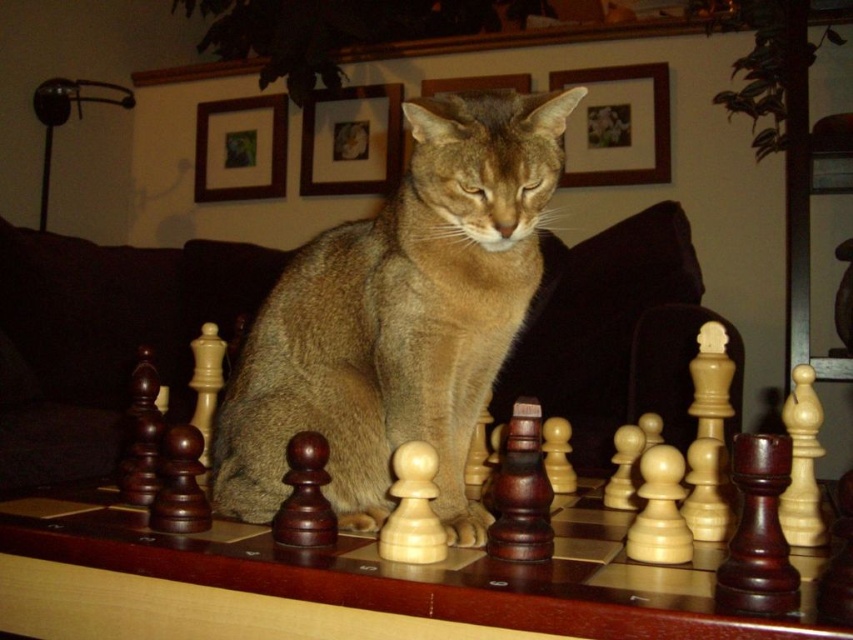
Question: Which object is closer to the camera taking this photo?

Choices:
 (A) golden fur cat at center
 (B) wooden chess pieces at center

Answer: (B)

Question: Does golden fur cat at center appear under wooden chess pieces at center?

Choices:
 (A) no
 (B) yes

Answer: (A)

Question: Which of the following is the farthest from the observer?

Choices:
 (A) golden fur cat at center
 (B) wooden chess pieces at center

Answer: (A)

Question: Can you confirm if golden fur cat at center is bigger than wooden chess pieces at center?

Choices:
 (A) no
 (B) yes

Answer: (A)

Question: Is golden fur cat at center thinner than wooden chess pieces at center?

Choices:
 (A) yes
 (B) no

Answer: (A)

Question: Which object is farther from the camera taking this photo?

Choices:
 (A) wooden chess pieces at center
 (B) golden fur cat at center

Answer: (B)